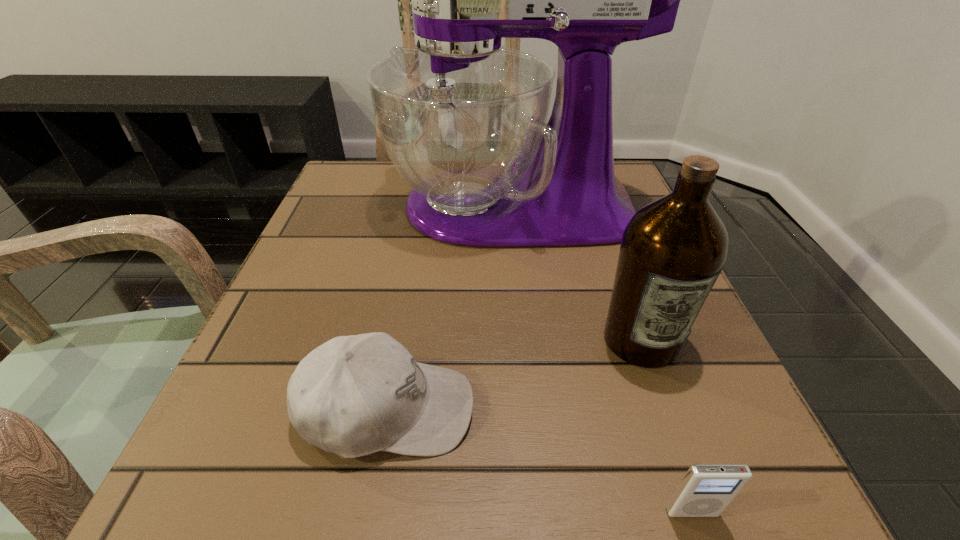
Where is `object that is at the near right corner`? The image size is (960, 540). object that is at the near right corner is located at coordinates pyautogui.click(x=706, y=490).

In the image, there is a desktop. Where is `vacant space at the near edge`? The width and height of the screenshot is (960, 540). vacant space at the near edge is located at coordinates (448, 525).

What are the coordinates of `free space at the left edge of the desktop` in the screenshot? It's located at (354, 284).

You are a GUI agent. You are given a task and a screenshot of the screen. Output one action in this format:
    pyautogui.click(x=<x>, y=<y>)
    Task: Click on the free location at the right edge of the desktop
    This screenshot has width=960, height=540.
    Given the screenshot: What is the action you would take?
    click(751, 432)

Find the location of a particular element. Image resolution: width=960 pixels, height=540 pixels. vacant space at the far left corner of the desktop is located at coordinates (353, 192).

Locate an element on the screen. The width and height of the screenshot is (960, 540). vacant space at the far right corner of the desktop is located at coordinates (617, 165).

This screenshot has width=960, height=540. I want to click on vacant area at the near right corner, so click(x=753, y=513).

Where is `vacant area between the iPod and the baseball cap`? Image resolution: width=960 pixels, height=540 pixels. vacant area between the iPod and the baseball cap is located at coordinates (540, 461).

This screenshot has width=960, height=540. Find the location of `free spot between the nearest object and the farthest object`. free spot between the nearest object and the farthest object is located at coordinates (601, 359).

Identify the location of unoccupied position between the baseball cap and the mixer. The height and width of the screenshot is (540, 960). (449, 308).